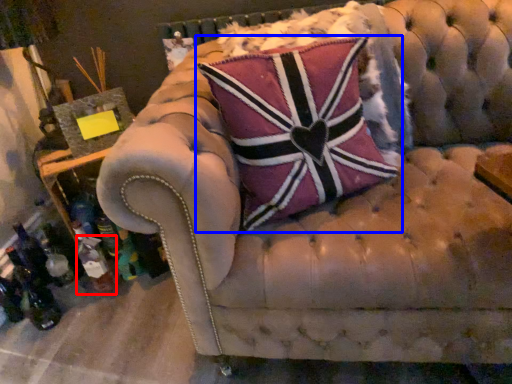
Question: Which of the following is the closest to the observer, bottle (highlighted by a red box) or pillow (highlighted by a blue box)?

Choices:
 (A) bottle
 (B) pillow

Answer: (B)